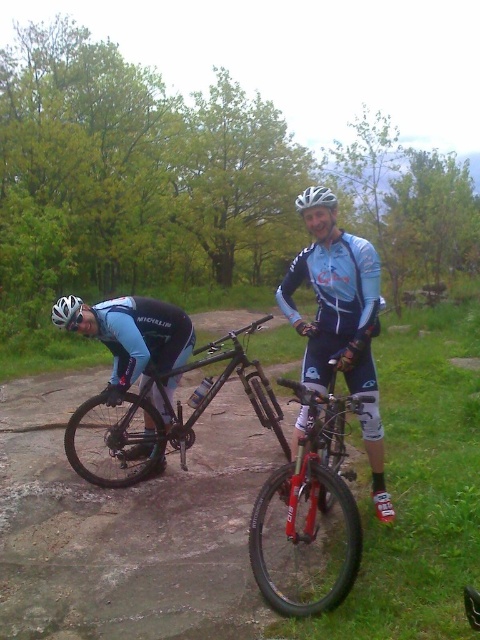
You are a photographer positioned at the scene. You want to take a photo that includes both the matte black mountain bike at left and the light blue jersey at center. Which object should you adjust your camera focus to first to ensure both are in the frame?

The matte black mountain bike at left is further to the viewer than the light blue jersey at center, so adjust focus to the matte black mountain bike at left first to ensure both are in the frame.

Consider the image. You are a photographer positioned at the camera. You want to take a photo that includes both the point at coordinates point (119, 477) and point (360, 353). Which point should you focus on first to ensure both are in focus?

You should focus on point (119, 477) first because it is closer to the camera than point (360, 353). This ensures the closer point is in focus, and the farther point will also be in focus due to depth of field.

You are a photographer taking a picture of two cyclists. In the scene, there are two white matte helmets visible. One is labeled as the white matte helmet at center and the other as the white matte bicycle helmet at left. From your vantage point, which helmet is positioned higher in the frame?

The white matte helmet at center is positioned higher in the frame than the white matte bicycle helmet at left.